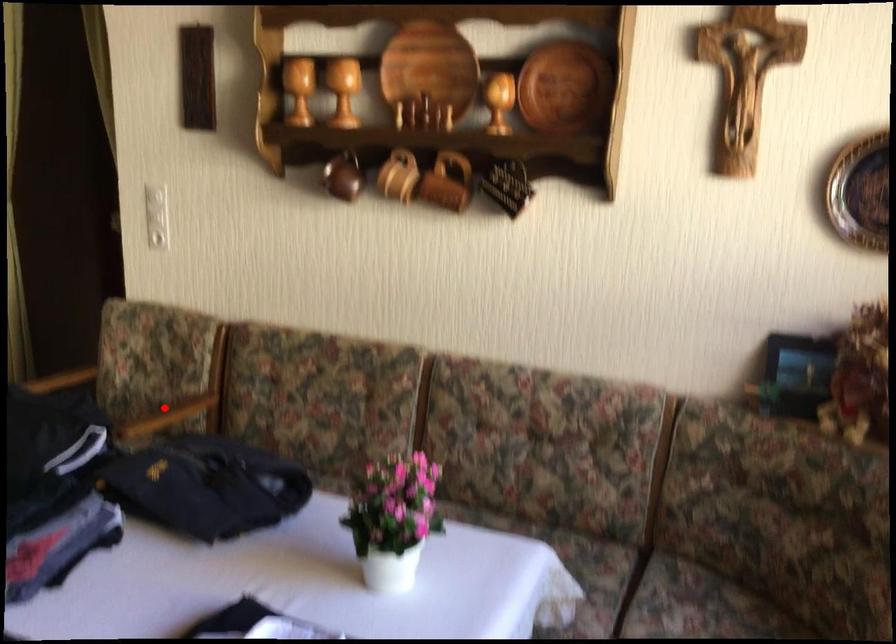
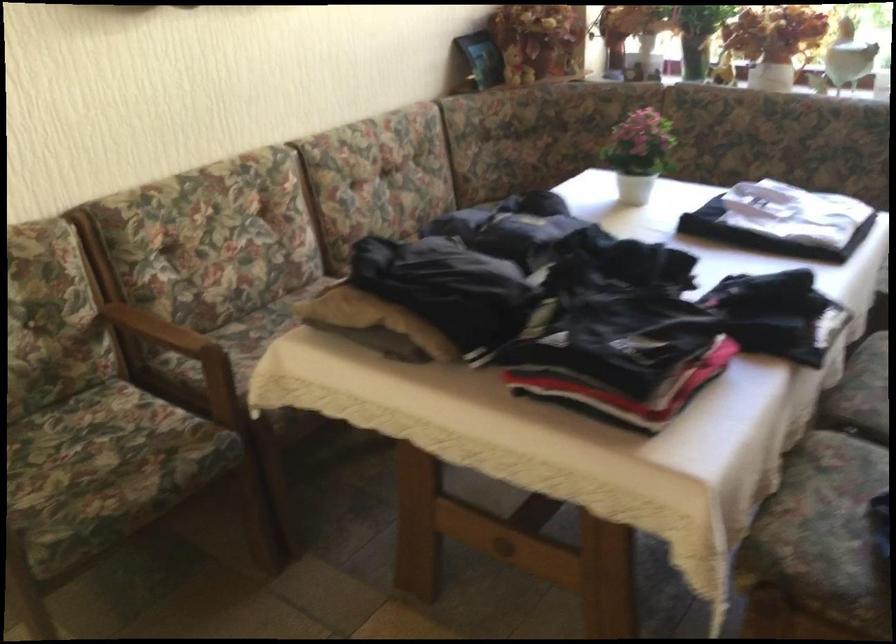
Question: I am providing you with two images of the same scene from different viewpoints. In image1, a red point is highlighted. Considering the same 3D point in image2, which of the following is correct?

Choices:
 (A) It is closer
 (B) It is farther

Answer: (A)